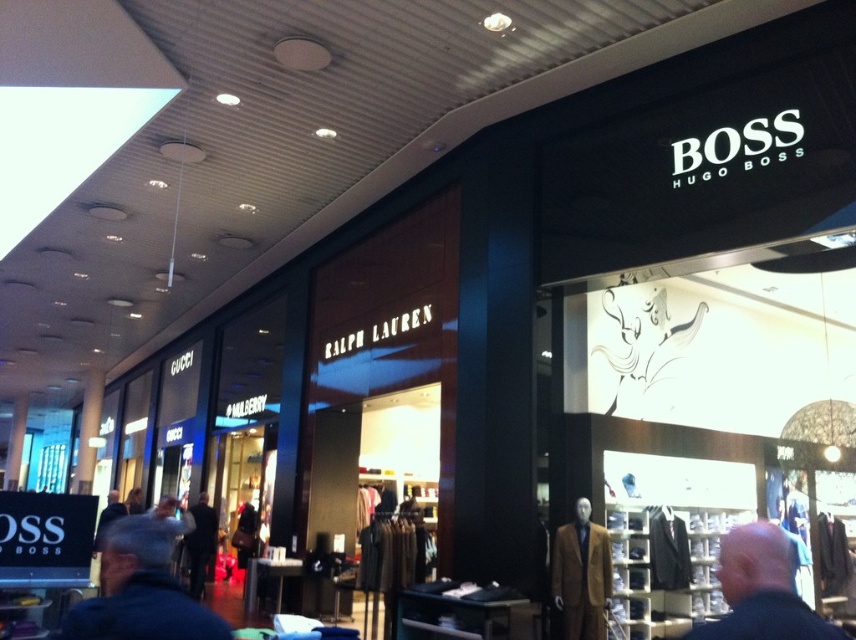
Between point (718, 554) and point (599, 572), which one is positioned behind?

Point (718, 554)

You are a GUI agent. You are given a task and a screenshot of the screen. Output one action in this format:
    pyautogui.click(x=<x>, y=<y>)
    Task: Click on the dark blue jacket at center
    This screenshot has width=856, height=640.
    Given the screenshot: What is the action you would take?
    pyautogui.click(x=761, y=589)

Which is in front, point (759, 627) or point (580, 502)?

Point (759, 627) is in front.

The height and width of the screenshot is (640, 856). What are the coordinates of `dark blue jacket at center` in the screenshot? It's located at (761, 589).

I want to click on dark blue jacket at center, so click(x=761, y=589).

Who is more distant from viewer, (761, 540) or (192, 554)?

Positioned behind is point (192, 554).

Find the location of `dark blue jacket at center`. dark blue jacket at center is located at coordinates (761, 589).

What do you see at coordinates (140, 589) in the screenshot? This screenshot has width=856, height=640. I see `dark blue jacket at lower left` at bounding box center [140, 589].

Who is higher up, dark blue jacket at lower left or dark blue jacket at center?

dark blue jacket at center

Is point (134, 554) less distant than point (730, 540)?

No, it is not.

Locate an element on the screen. dark blue jacket at lower left is located at coordinates (140, 589).